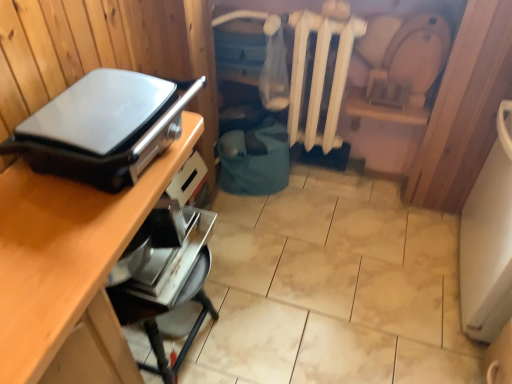
Question: Is metallic silver toaster at lower center, the 2th appliance positioned from the top, positioned beyond the bounds of matte black appliance at left, arranged as the first appliance when viewed from the top?

Choices:
 (A) yes
 (B) no

Answer: (A)

Question: Considering the relative sizes of metallic silver toaster at lower center, the 2th appliance positioned from the top, and matte black appliance at left, which is the second appliance from bottom to top, in the image provided, is metallic silver toaster at lower center, the 2th appliance positioned from the top, taller than matte black appliance at left, which is the second appliance from bottom to top,?

Choices:
 (A) no
 (B) yes

Answer: (A)

Question: Is metallic silver toaster at lower center, the 2th appliance positioned from the top, facing towards matte black appliance at left, arranged as the first appliance when viewed from the top?

Choices:
 (A) no
 (B) yes

Answer: (A)

Question: Is the surface of metallic silver toaster at lower center, marked as the 1th appliance in a bottom-to-top arrangement, in direct contact with matte black appliance at left, arranged as the first appliance when viewed from the top?

Choices:
 (A) yes
 (B) no

Answer: (B)

Question: From a real-world perspective, is metallic silver toaster at lower center, the 2th appliance positioned from the top, under matte black appliance at left, arranged as the first appliance when viewed from the top?

Choices:
 (A) yes
 (B) no

Answer: (A)

Question: Considering the positions of metallic silver toaster at lower center, marked as the 1th appliance in a bottom-to-top arrangement, and white matte radiator at center in the image, is metallic silver toaster at lower center, marked as the 1th appliance in a bottom-to-top arrangement, wider or thinner than white matte radiator at center?

Choices:
 (A) thin
 (B) wide

Answer: (B)

Question: Considering their positions, is metallic silver toaster at lower center, the 2th appliance positioned from the top, located in front of or behind white matte radiator at center?

Choices:
 (A) behind
 (B) front

Answer: (B)

Question: Is metallic silver toaster at lower center, marked as the 1th appliance in a bottom-to-top arrangement, taller or shorter than white matte radiator at center?

Choices:
 (A) tall
 (B) short

Answer: (B)

Question: Looking at the image, does metallic silver toaster at lower center, marked as the 1th appliance in a bottom-to-top arrangement, seem bigger or smaller compared to white matte radiator at center?

Choices:
 (A) small
 (B) big

Answer: (A)

Question: Considering the positions of white matte radiator at center and matte black appliance at left, arranged as the first appliance when viewed from the top, in the image, is white matte radiator at center bigger or smaller than matte black appliance at left, arranged as the first appliance when viewed from the top,?

Choices:
 (A) big
 (B) small

Answer: (A)

Question: From the image's perspective, is white matte radiator at center located above or below matte black appliance at left, arranged as the first appliance when viewed from the top?

Choices:
 (A) above
 (B) below

Answer: (A)

Question: Looking at their shapes, would you say white matte radiator at center is wider or thinner than matte black appliance at left, arranged as the first appliance when viewed from the top?

Choices:
 (A) wide
 (B) thin

Answer: (B)

Question: Would you say white matte radiator at center is inside or outside matte black appliance at left, arranged as the first appliance when viewed from the top?

Choices:
 (A) inside
 (B) outside

Answer: (B)

Question: From a real-world perspective, is matte black appliance at left, arranged as the first appliance when viewed from the top, physically located above or below metallic silver toaster at lower center, marked as the 1th appliance in a bottom-to-top arrangement?

Choices:
 (A) above
 (B) below

Answer: (A)

Question: Is matte black appliance at left, which is the second appliance from bottom to top, to the left or to the right of metallic silver toaster at lower center, marked as the 1th appliance in a bottom-to-top arrangement, in the image?

Choices:
 (A) right
 (B) left

Answer: (B)